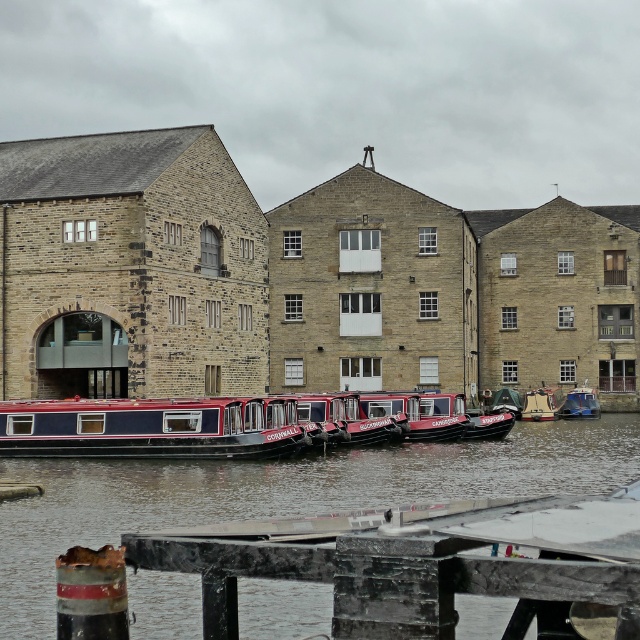
Is smooth dark blue water at center positioned before blue polished wood barge at lower left?

Yes, it is in front of blue polished wood barge at lower left.

In order to click on smooth dark blue water at center in this screenshot , I will do `click(276, 493)`.

Who is more forward, [129,440] or [589,394]?

Point [129,440] is more forward.

Is blue polished wood barge at lower left shorter than metallic blue boat at center?

In fact, blue polished wood barge at lower left may be taller than metallic blue boat at center.

Is point (32, 442) closer to viewer compared to point (586, 392)?

Yes, point (32, 442) is in front of point (586, 392).

Identify the location of blue polished wood barge at lower left. (147, 428).

The height and width of the screenshot is (640, 640). Describe the element at coordinates (276, 493) in the screenshot. I see `smooth dark blue water at center` at that location.

Is smooth dark blue water at center above metallic blue boat at center?

No, smooth dark blue water at center is not above metallic blue boat at center.

Describe the element at coordinates (276, 493) in the screenshot. I see `smooth dark blue water at center` at that location.

Identify the location of smooth dark blue water at center. This screenshot has width=640, height=640. (276, 493).